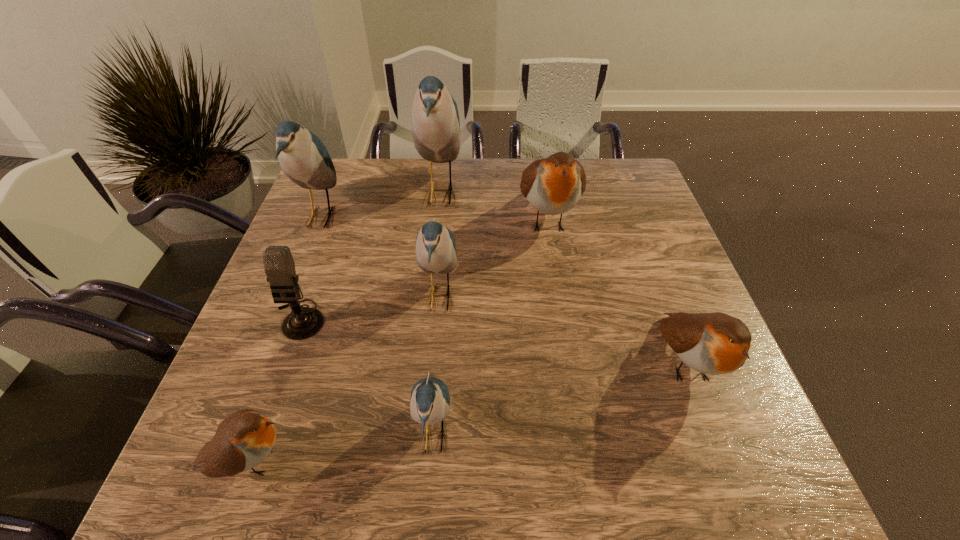
What are the coordinates of `free location that satisfies the following two spatial constraints: 1. at the tip of the second nearest blue bird's beak; 2. on the front-facing side of the microphone` in the screenshot? It's located at (438, 319).